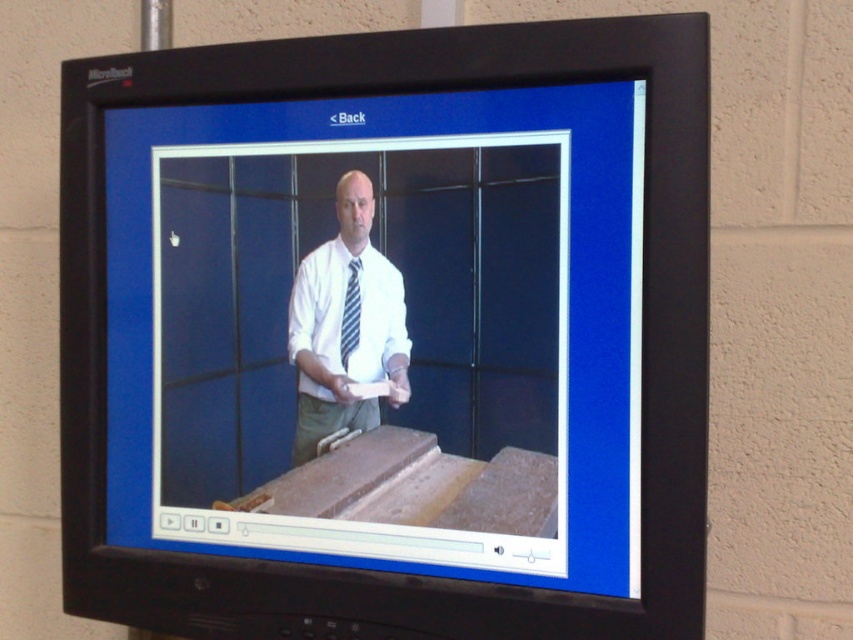
Question: Which of the following is the closest to the observer?

Choices:
 (A) (332, 356)
 (B) (358, 314)

Answer: (B)

Question: Considering the relative positions of white glossy shirt at center and striped fabric tie at center in the image provided, where is white glossy shirt at center located with respect to striped fabric tie at center?

Choices:
 (A) above
 (B) below

Answer: (B)

Question: In this image, where is white glossy shirt at center located relative to striped fabric tie at center?

Choices:
 (A) below
 (B) above

Answer: (A)

Question: Is white glossy shirt at center above striped fabric tie at center?

Choices:
 (A) yes
 (B) no

Answer: (B)

Question: Which of the following is the closest to the observer?

Choices:
 (A) (341, 188)
 (B) (344, 317)

Answer: (A)